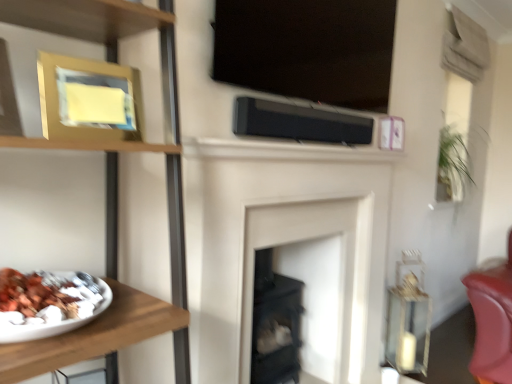
Question: Is wooden plate at left thinner than black matte speaker at center?

Choices:
 (A) yes
 (B) no

Answer: (B)

Question: Considering the relative sizes of wooden plate at left and black matte speaker at center in the image provided, is wooden plate at left smaller than black matte speaker at center?

Choices:
 (A) yes
 (B) no

Answer: (B)

Question: Can you confirm if wooden plate at left is wider than black matte speaker at center?

Choices:
 (A) no
 (B) yes

Answer: (B)

Question: From the image's perspective, is wooden plate at left above black matte speaker at center?

Choices:
 (A) yes
 (B) no

Answer: (B)

Question: From the image's perspective, is wooden plate at left located beneath black matte speaker at center?

Choices:
 (A) yes
 (B) no

Answer: (A)

Question: Considering the relative sizes of wooden plate at left and black matte speaker at center in the image provided, is wooden plate at left bigger than black matte speaker at center?

Choices:
 (A) yes
 (B) no

Answer: (A)

Question: Is black matte speaker at center to the left of wooden plate at left from the viewer's perspective?

Choices:
 (A) yes
 (B) no

Answer: (B)

Question: Considering the relative sizes of black matte speaker at center and wooden plate at left in the image provided, is black matte speaker at center bigger than wooden plate at left?

Choices:
 (A) no
 (B) yes

Answer: (A)

Question: From a real-world perspective, does black matte speaker at center sit lower than wooden plate at left?

Choices:
 (A) no
 (B) yes

Answer: (A)

Question: Is black matte speaker at center oriented away from wooden plate at left?

Choices:
 (A) yes
 (B) no

Answer: (B)

Question: Is black matte speaker at center oriented towards wooden plate at left?

Choices:
 (A) no
 (B) yes

Answer: (A)

Question: Can you confirm if black matte speaker at center is positioned to the right of wooden plate at left?

Choices:
 (A) yes
 (B) no

Answer: (A)

Question: From the image's perspective, is wooden plate at left located above gold metallic picture frame at upper left?

Choices:
 (A) yes
 (B) no

Answer: (B)